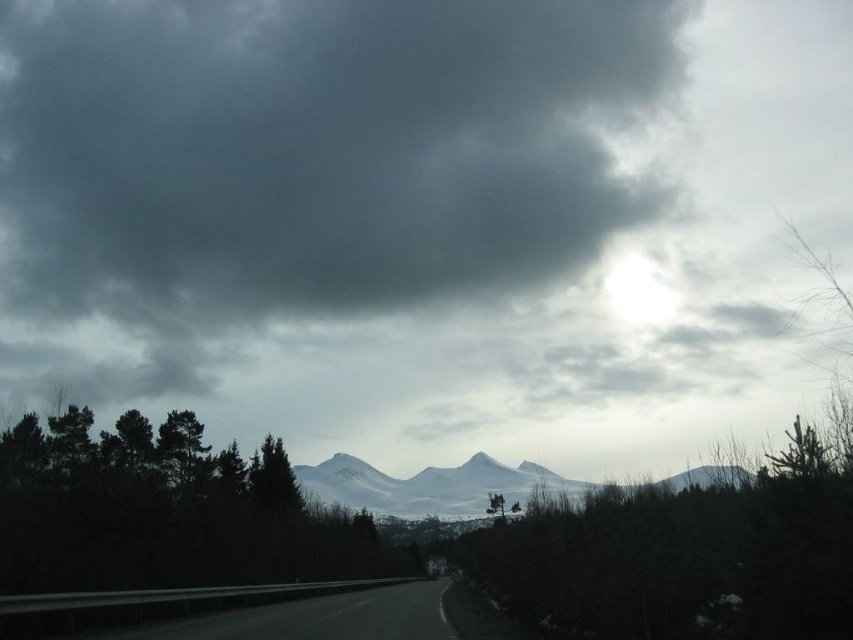
You are a photographer planning to capture the entire scene of the dark gray cloud at upper center and the black asphalt highway at lower center in a single shot. Based on their sizes, which object would appear more prominent in the photograph?

The dark gray cloud at upper center would appear more prominent in the photograph since it has a larger size compared to the black asphalt highway at lower center.

You are a hiker planning to cross the black asphalt highway at lower center. You notice a dark gray cloud at upper center. Which object is more to the left?

The dark gray cloud at upper center is more to the left side of the black asphalt highway at lower center.

Looking at this image, you are a hiker planning to take the road in the image. You notice a point marked at coordinates (300,170). What object is located at that point?

The point at coordinates (300,170) indicates a dark gray cloud at upper center.